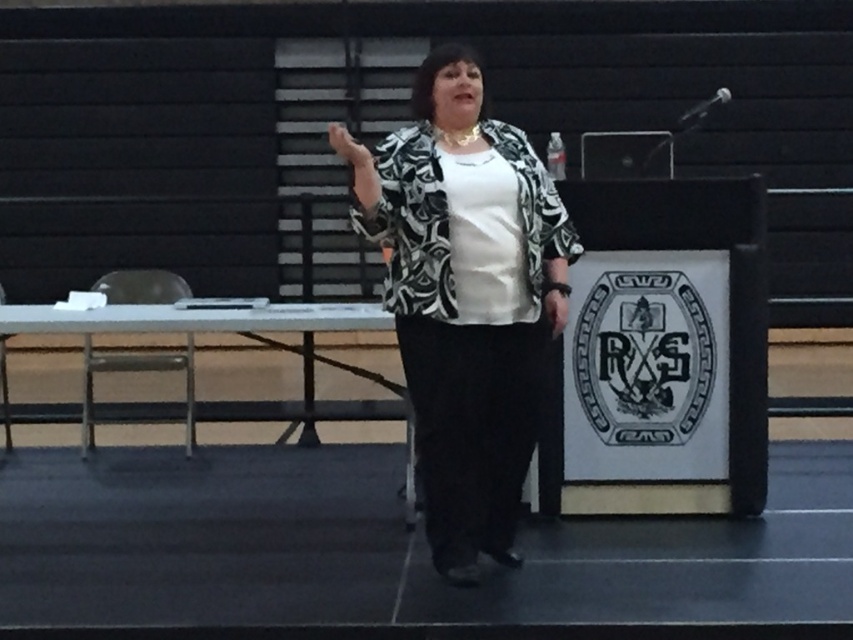
You are an event organizer who needs to ensure the presenter can move freely during their talk. Based on the image, is the printed fabric jacket at center positioned in a way that might interfere with the presenter reaching the matte black hand at upper center?

The printed fabric jacket at center is below the matte black hand at upper center, so it is unlikely to interfere with the presenter reaching the hand.

Where is the printed fabric jacket at center located in the image?

The printed fabric jacket at center is located at point coordinates of (467, 300).